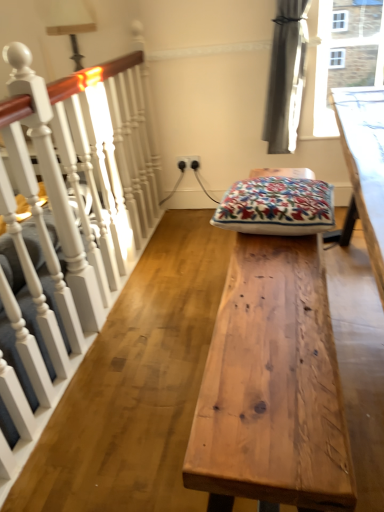
Question: Considering their positions, is natural wood table at center located in front of or behind white painted wood at left?

Choices:
 (A) front
 (B) behind

Answer: (B)

Question: Considering the positions of natural wood table at center and white painted wood at left in the image, is natural wood table at center taller or shorter than white painted wood at left?

Choices:
 (A) tall
 (B) short

Answer: (B)

Question: Based on their relative distances, which object is nearer to the natural wood table at center?

Choices:
 (A) white painted wood at left
 (B) embroidered cotton cushion at center

Answer: (B)

Question: Which is farther from the natural wood table at center?

Choices:
 (A) white painted wood at left
 (B) embroidered cotton cushion at center

Answer: (A)